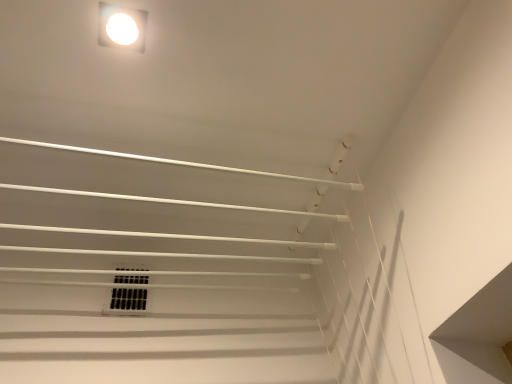
Question: Is white matte light fixture at upper center not close to black plastic vent at center?

Choices:
 (A) yes
 (B) no

Answer: (B)

Question: Does white matte light fixture at upper center have a lesser width compared to black plastic vent at center?

Choices:
 (A) no
 (B) yes

Answer: (A)

Question: Can you confirm if white matte light fixture at upper center is bigger than black plastic vent at center?

Choices:
 (A) no
 (B) yes

Answer: (A)

Question: Can you confirm if white matte light fixture at upper center is wider than black plastic vent at center?

Choices:
 (A) no
 (B) yes

Answer: (B)

Question: Is white matte light fixture at upper center closer to the viewer compared to black plastic vent at center?

Choices:
 (A) no
 (B) yes

Answer: (B)

Question: From the image's perspective, is white matte light fixture at upper center beneath black plastic vent at center?

Choices:
 (A) yes
 (B) no

Answer: (B)

Question: Is black plastic vent at center positioned with its back to white matte light fixture at upper center?

Choices:
 (A) yes
 (B) no

Answer: (B)

Question: Could white matte light fixture at upper center be considered to be inside black plastic vent at center?

Choices:
 (A) no
 (B) yes

Answer: (A)

Question: Is black plastic vent at center further to camera compared to white matte light fixture at upper center?

Choices:
 (A) no
 (B) yes

Answer: (B)

Question: Could you tell me if black plastic vent at center is turned towards white matte light fixture at upper center?

Choices:
 (A) yes
 (B) no

Answer: (A)

Question: Considering the relative positions of black plastic vent at center and white matte light fixture at upper center in the image provided, is black plastic vent at center in front of white matte light fixture at upper center?

Choices:
 (A) yes
 (B) no

Answer: (B)

Question: Considering the relative positions of black plastic vent at center and white matte light fixture at upper center in the image provided, is black plastic vent at center to the right of white matte light fixture at upper center from the viewer's perspective?

Choices:
 (A) no
 (B) yes

Answer: (A)

Question: Do you think black plastic vent at center is within white matte light fixture at upper center, or outside of it?

Choices:
 (A) inside
 (B) outside

Answer: (B)